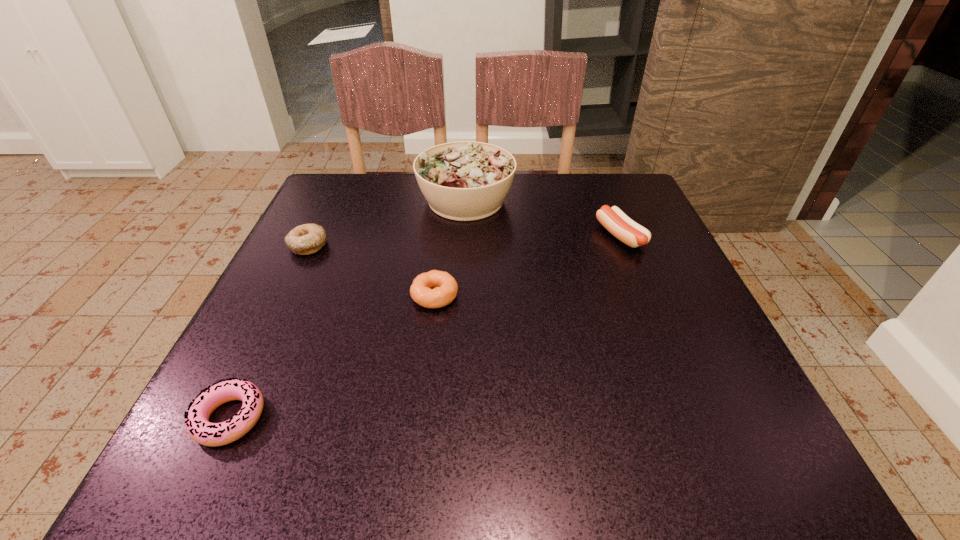
At what (x,y) coordinates should I click in order to perform the action: click on salad. Please return your answer as a coordinate pair (x, y). Looking at the image, I should click on (465, 180).

Where is `sausage`? sausage is located at coordinates (629, 232).

Image resolution: width=960 pixels, height=540 pixels. Identify the location of the fourth farthest object. (434, 289).

Identify the location of the second nearest doughnut. This screenshot has width=960, height=540. (434, 289).

Locate an element on the screen. The height and width of the screenshot is (540, 960). the farthest doughnut is located at coordinates (306, 239).

Locate an element on the screen. The image size is (960, 540). the nearest object is located at coordinates (198, 426).

This screenshot has width=960, height=540. Identify the location of vacant space located on the front of the tallest object. (459, 354).

Where is `free location located on the left of the sausage`? This screenshot has width=960, height=540. free location located on the left of the sausage is located at coordinates (435, 235).

Find the location of a particular element. This screenshot has height=540, width=960. free spot located on the front of the second nearest object is located at coordinates (416, 463).

At what (x,y) coordinates should I click in order to perform the action: click on vacant space situated 0.350m on the right of the farthest doughnut. Please return your answer as a coordinate pair (x, y). This screenshot has height=540, width=960. Looking at the image, I should click on (491, 245).